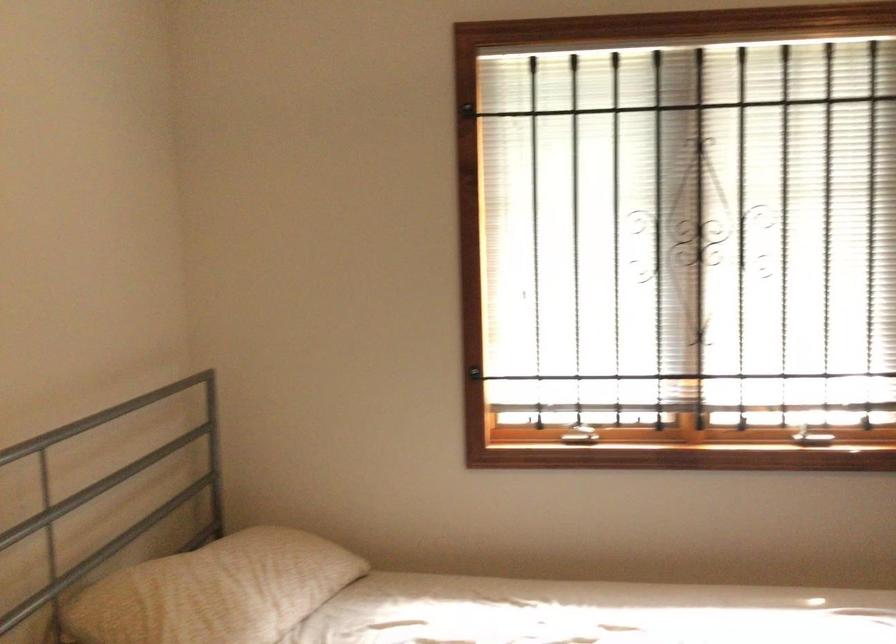
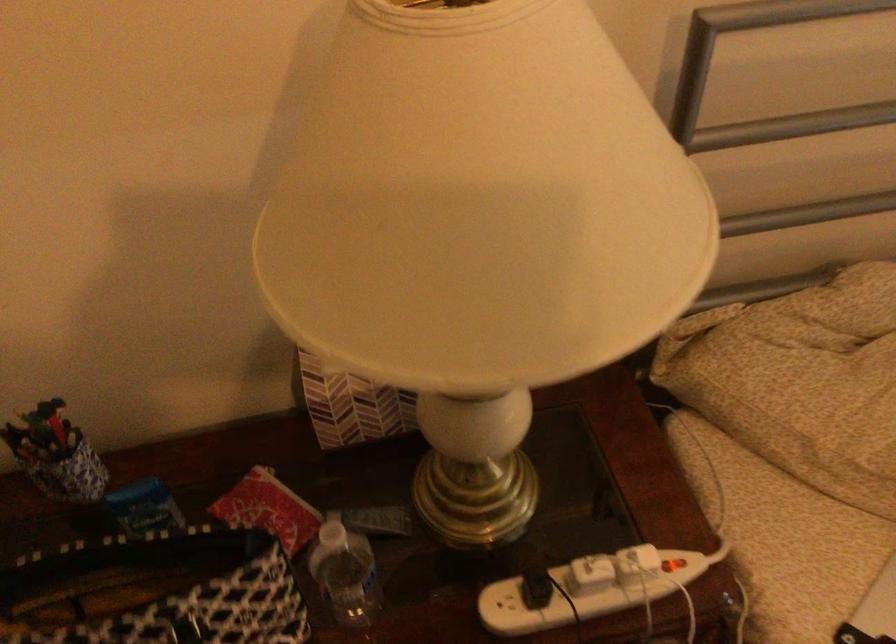
How did the camera likely rotate?

The camera rotated toward left-down.